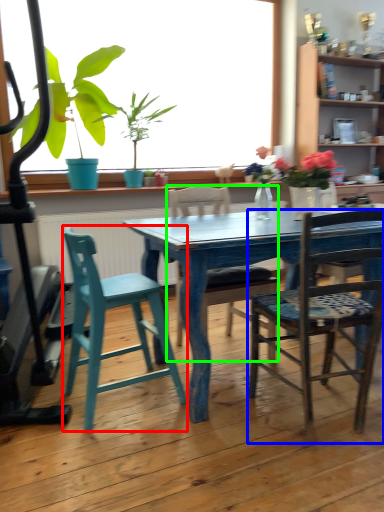
Question: Which object is positioned closest to chair (highlighted by a red box)? Select from chair (highlighted by a blue box) and chair (highlighted by a green box).

Choices:
 (A) chair
 (B) chair

Answer: (B)